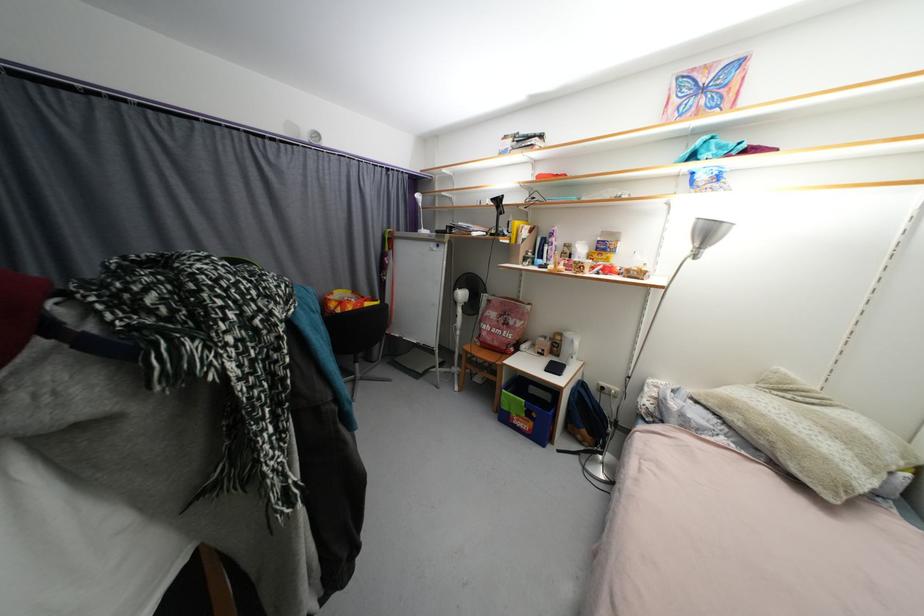
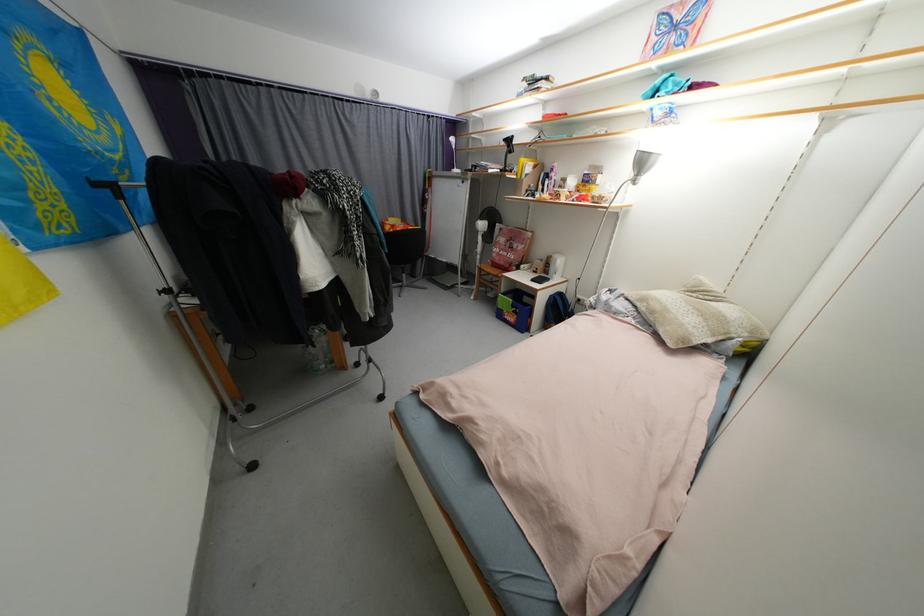
Find the pixel in the second image that matches (517,323) in the first image.

(520, 248)